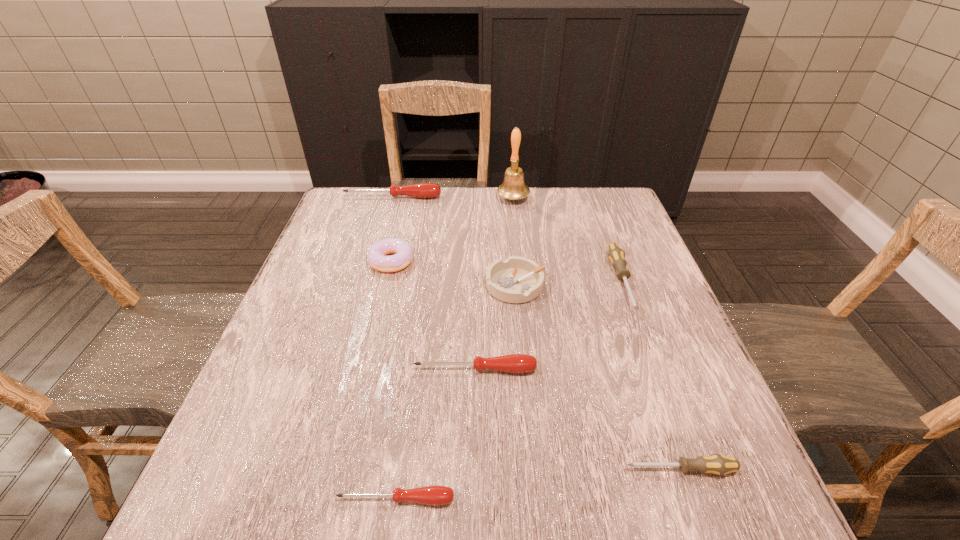
Find the location of `the second nearest object`. the second nearest object is located at coordinates (717, 464).

The height and width of the screenshot is (540, 960). What are the coordinates of `the nearest red screwdriver` in the screenshot? It's located at (435, 495).

The image size is (960, 540). Find the location of `the nearest object`. the nearest object is located at coordinates (435, 495).

The height and width of the screenshot is (540, 960). In order to click on free location located 0.080m on the left of the tallest object in this screenshot , I will do `click(470, 199)`.

Locate an element on the screen. This screenshot has width=960, height=540. vacant area situated 0.090m on the right of the farthest screwdriver is located at coordinates (470, 197).

This screenshot has height=540, width=960. Identify the location of free space located 0.190m on the front of the doughnut. (374, 333).

You are a GUI agent. You are given a task and a screenshot of the screen. Output one action in this format:
    pyautogui.click(x=<x>, y=<y>)
    Task: Click on the vacant area located at the tip of the second farthest screwdriver
    This screenshot has height=540, width=960.
    Given the screenshot: What is the action you would take?
    pyautogui.click(x=676, y=430)

Locate an element on the screen. The image size is (960, 540). vacant region located 0.080m on the back of the ashtray is located at coordinates (513, 248).

Identify the location of free location located on the left of the second smallest red screwdriver. The image size is (960, 540). (369, 369).

Image resolution: width=960 pixels, height=540 pixels. I want to click on vacant space located 0.130m at the tip of the second nearest object, so click(x=544, y=469).